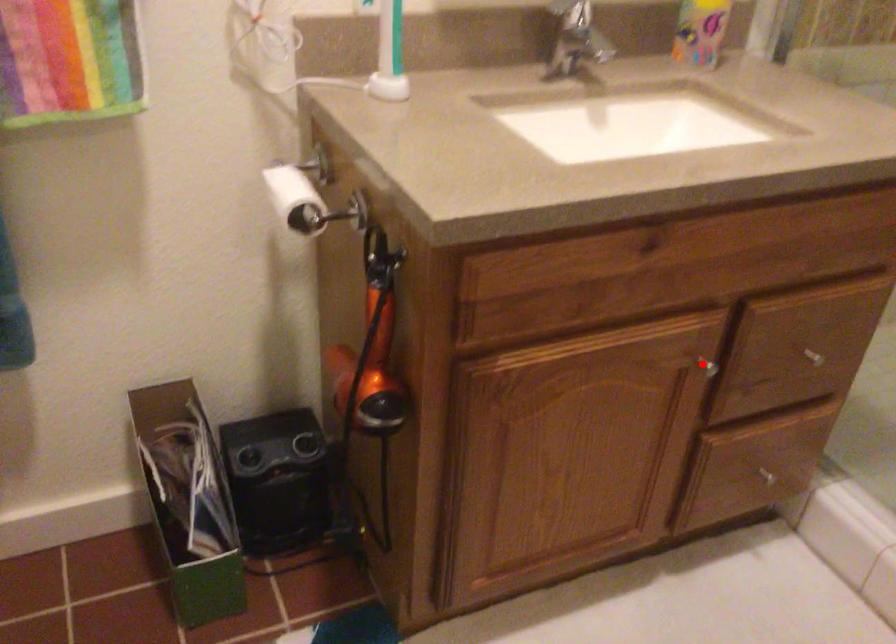
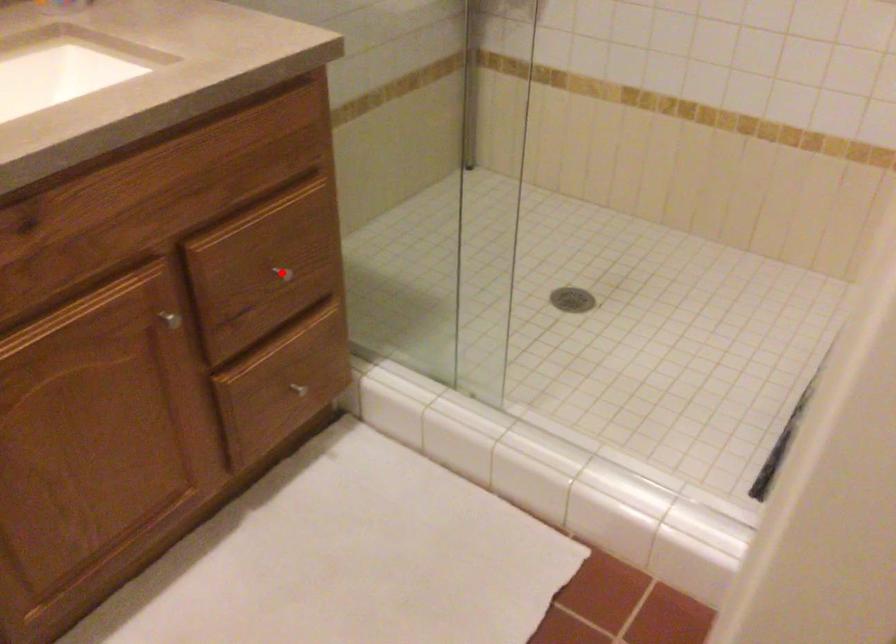
I am providing you with two images of the same scene from different viewpoints. A red point is marked on the first image and another point is marked on the second image. Does the point marked in image1 correspond to the same location as the one in image2?

No